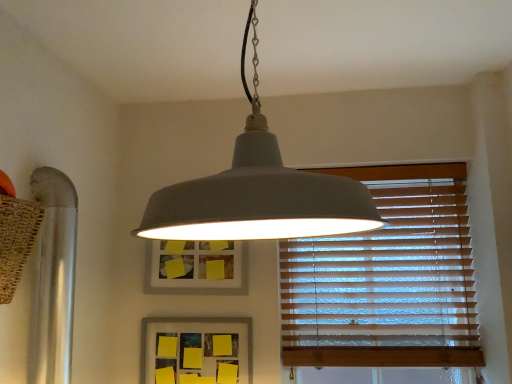
Question: Does matte gray picture frame at center, acting as the first picture frame starting from the top, turn towards yellow matte picture frame at center, which appears as the 1th picture frame when ordered from the bottom?

Choices:
 (A) no
 (B) yes

Answer: (A)

Question: Is matte gray picture frame at center, the second picture frame ordered from the bottom, smaller than yellow matte picture frame at center, which appears as the 1th picture frame when ordered from the bottom?

Choices:
 (A) yes
 (B) no

Answer: (B)

Question: Is matte gray picture frame at center, the second picture frame ordered from the bottom, to the right of yellow matte picture frame at center, which appears as the 1th picture frame when ordered from the bottom, from the viewer's perspective?

Choices:
 (A) yes
 (B) no

Answer: (B)

Question: Is matte gray picture frame at center, acting as the first picture frame starting from the top, facing away from yellow matte picture frame at center, which appears as the 1th picture frame when ordered from the bottom?

Choices:
 (A) yes
 (B) no

Answer: (B)

Question: From the image's perspective, is matte gray picture frame at center, the second picture frame ordered from the bottom, beneath yellow matte picture frame at center, which appears as the second picture frame when viewed from the top?

Choices:
 (A) no
 (B) yes

Answer: (A)

Question: Is yellow matte picture frame at center, which appears as the 1th picture frame when ordered from the bottom, inside the boundaries of wooden blinds at right, or outside?

Choices:
 (A) inside
 (B) outside

Answer: (B)

Question: Is yellow matte picture frame at center, which appears as the 1th picture frame when ordered from the bottom, wider or thinner than wooden blinds at right?

Choices:
 (A) wide
 (B) thin

Answer: (B)

Question: From a real-world perspective, is yellow matte picture frame at center, which appears as the 1th picture frame when ordered from the bottom, positioned above or below wooden blinds at right?

Choices:
 (A) above
 (B) below

Answer: (B)

Question: Based on their positions, is yellow matte picture frame at center, which appears as the 1th picture frame when ordered from the bottom, located to the left or right of wooden blinds at right?

Choices:
 (A) right
 (B) left

Answer: (B)

Question: From a real-world perspective, is wooden blinds at right above or below matte gray pendant light at center?

Choices:
 (A) above
 (B) below

Answer: (B)

Question: Is wooden blinds at right wider or thinner than matte gray pendant light at center?

Choices:
 (A) thin
 (B) wide

Answer: (A)

Question: Considering the positions of point (443, 266) and point (222, 190), is point (443, 266) closer or farther from the camera than point (222, 190)?

Choices:
 (A) farther
 (B) closer

Answer: (A)

Question: From the image's perspective, is wooden blinds at right located above or below matte gray pendant light at center?

Choices:
 (A) above
 (B) below

Answer: (B)

Question: Does point (174, 264) appear closer or farther from the camera than point (141, 329)?

Choices:
 (A) closer
 (B) farther

Answer: (B)

Question: Considering the relative positions of matte gray picture frame at center, acting as the first picture frame starting from the top, and yellow matte picture frame at center, which appears as the 1th picture frame when ordered from the bottom, in the image provided, is matte gray picture frame at center, acting as the first picture frame starting from the top, to the left or to the right of yellow matte picture frame at center, which appears as the 1th picture frame when ordered from the bottom,?

Choices:
 (A) left
 (B) right

Answer: (A)